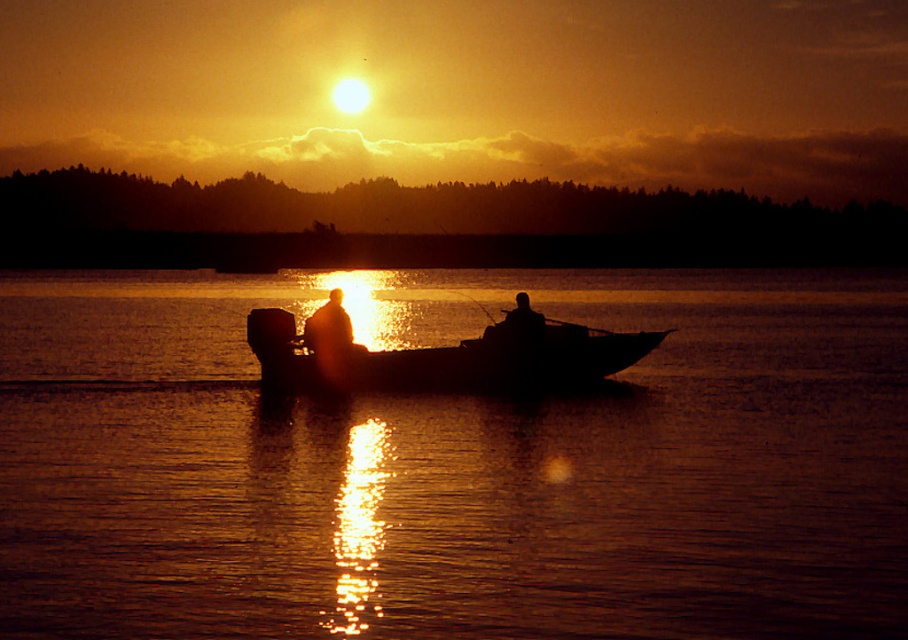
Question: Which point is farther to the camera?

Choices:
 (A) silhouette wooden boat at center
 (B) silky water at center

Answer: (A)

Question: In this image, where is silky water at center located relative to silhouette wooden boat at center?

Choices:
 (A) right
 (B) left

Answer: (A)

Question: Is silky water at center wider than silhouette wooden boat at center?

Choices:
 (A) no
 (B) yes

Answer: (B)

Question: Is silky water at center to the right of silhouette wooden boat at center from the viewer's perspective?

Choices:
 (A) yes
 (B) no

Answer: (A)